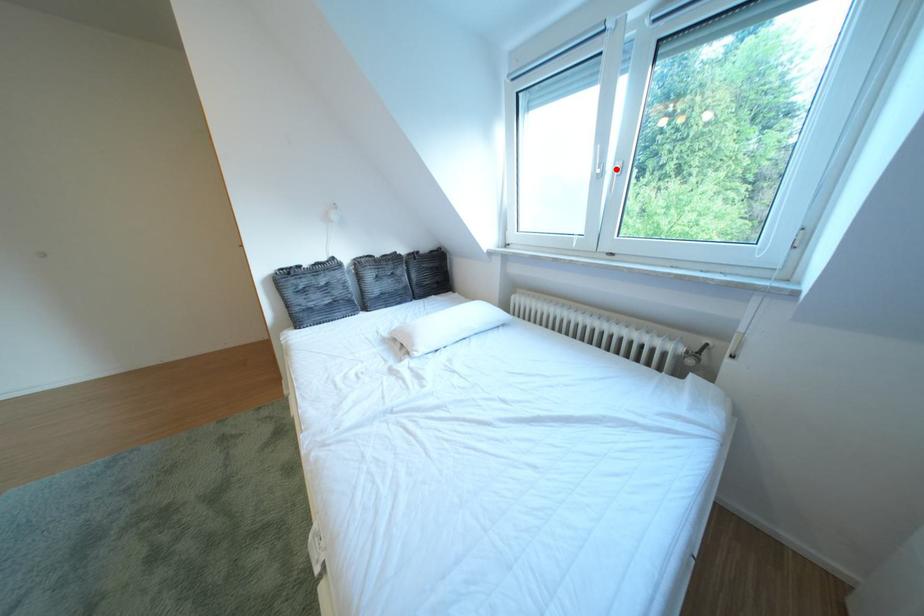
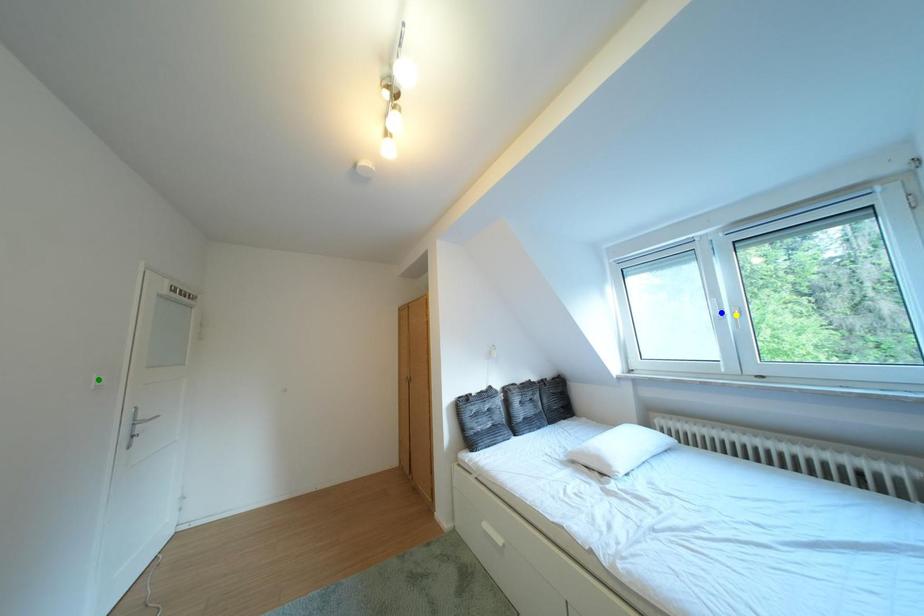
Question: I am providing you with two images of the same scene from different viewpoints. A red point is marked on the first image. You are given multiple points on the second image. Which spot in image 2 lines up with the point in image 1?

Choices:
 (A) blue point
 (B) yellow point
 (C) green point

Answer: (B)